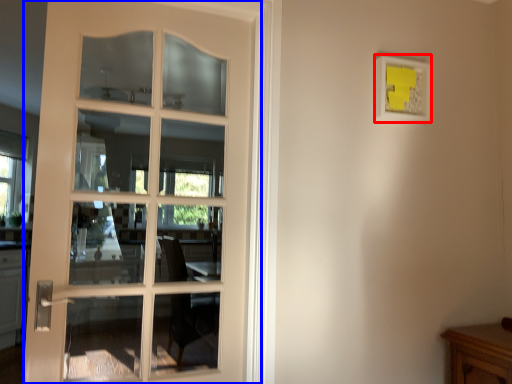
Question: Which object is closer to the camera taking this photo, picture frame (highlighted by a red box) or door (highlighted by a blue box)?

Choices:
 (A) picture frame
 (B) door

Answer: (B)